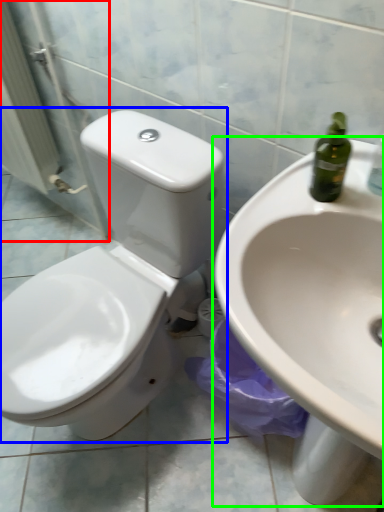
Question: Based on their relative distances, which object is nearer to screen door (highlighted by a red box)? Choose from toilet (highlighted by a blue box) and sink (highlighted by a green box).

Choices:
 (A) toilet
 (B) sink

Answer: (A)